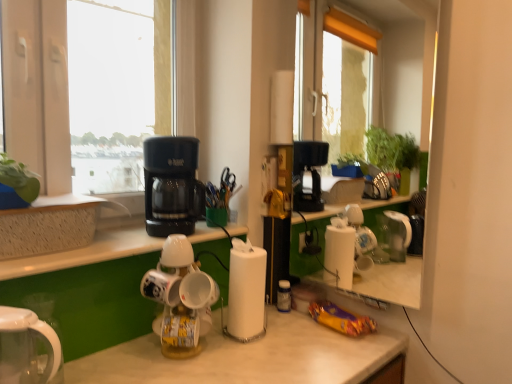
Question: From their relative heights in the image, would you say white matte cup at center is taller or shorter than translucent plastic bottle at center?

Choices:
 (A) tall
 (B) short

Answer: (B)

Question: From the image's perspective, is white matte cup at center above or below translucent plastic bottle at center?

Choices:
 (A) below
 (B) above

Answer: (B)

Question: Estimate the real-world distances between objects in this image. Which object is closer to the textured concrete at left?

Choices:
 (A) white glossy mug at center, which is the first mug in right-to-left order
 (B) transparent glass window at upper left
 (C) white glossy mug rack at center, the 2th kitchen appliance from the top
 (D) green leafy plant at upper left
 (E) black plastic coffee maker at upper left, which is the second kitchen appliance in bottom-to-top order

Answer: (D)

Question: Which is nearer to the textured concrete at left?

Choices:
 (A) white glossy mug rack at center, positioned as the first kitchen appliance in bottom-to-top order
 (B) white matte cup at center
 (C) white glossy mug at center, which is the first mug in right-to-left order
 (D) white glossy mug at center, the second mug when ordered from right to left
 (E) black plastic coffee maker at upper left, which appears as the 1th kitchen appliance when viewed from the top

Answer: (B)